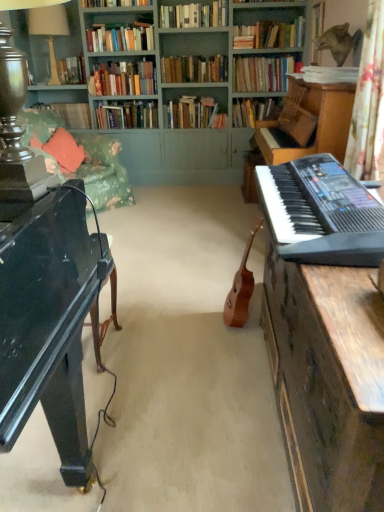
Question: Can you confirm if light brown wood guitar at center is shorter than hardcover books at upper center, which is the sixth book in front-to-back order?

Choices:
 (A) no
 (B) yes

Answer: (A)

Question: Is the surface of light brown wood guitar at center in direct contact with hardcover books at upper center, which is the 6th book from back to front?

Choices:
 (A) no
 (B) yes

Answer: (A)

Question: From a real-world perspective, is light brown wood guitar at center located higher than hardcover books at upper center, which is the 6th book from back to front?

Choices:
 (A) no
 (B) yes

Answer: (A)

Question: Can you confirm if light brown wood guitar at center is thinner than hardcover books at upper center, which is the sixth book in front-to-back order?

Choices:
 (A) no
 (B) yes

Answer: (A)

Question: Does light brown wood guitar at center have a larger size compared to hardcover books at upper center, which is the sixth book in front-to-back order?

Choices:
 (A) yes
 (B) no

Answer: (A)

Question: Does point (x=117, y=120) appear closer or farther from the camera than point (x=145, y=84)?

Choices:
 (A) closer
 (B) farther

Answer: (B)

Question: Looking at their shapes, would you say hardcover books at center, which is counted as the second book, starting from the back, is wider or thinner than hardcover books at upper center, which is the 6th book from back to front?

Choices:
 (A) wide
 (B) thin

Answer: (A)

Question: From their relative heights in the image, would you say hardcover books at center, positioned as the 10th book in front-to-back order, is taller or shorter than hardcover books at upper center, which is the sixth book in front-to-back order?

Choices:
 (A) short
 (B) tall

Answer: (A)

Question: From the image's perspective, relative to hardcover books at upper center, which is the 6th book from back to front, is hardcover books at center, positioned as the 10th book in front-to-back order, above or below?

Choices:
 (A) above
 (B) below

Answer: (B)

Question: From a real-world perspective, relative to hardcover book at upper left, which is counted as the eleventh book, starting from the front, is white paper at upper right, the first book viewed from the front, vertically above or below?

Choices:
 (A) below
 (B) above

Answer: (B)

Question: In terms of height, does white paper at upper right, which ranks as the 11th book in back-to-front order, look taller or shorter compared to hardcover book at upper left, which is counted as the eleventh book, starting from the front?

Choices:
 (A) short
 (B) tall

Answer: (A)

Question: In terms of size, does white paper at upper right, which ranks as the 11th book in back-to-front order, appear bigger or smaller than hardcover book at upper left, which is counted as the eleventh book, starting from the front?

Choices:
 (A) small
 (B) big

Answer: (A)

Question: Is white paper at upper right, which ranks as the 11th book in back-to-front order, inside or outside of hardcover book at upper left, which is counted as the eleventh book, starting from the front?

Choices:
 (A) inside
 (B) outside

Answer: (B)

Question: From the image's perspective, relative to hardcover books at upper center, the 8th book in the back-to-front sequence, is hardcover book at upper left, the 1th book positioned from the back, above or below?

Choices:
 (A) below
 (B) above

Answer: (A)

Question: Considering the positions of hardcover book at upper left, the 1th book positioned from the back, and hardcover books at upper center, acting as the 4th book starting from the front, in the image, is hardcover book at upper left, the 1th book positioned from the back, taller or shorter than hardcover books at upper center, acting as the 4th book starting from the front,?

Choices:
 (A) tall
 (B) short

Answer: (B)